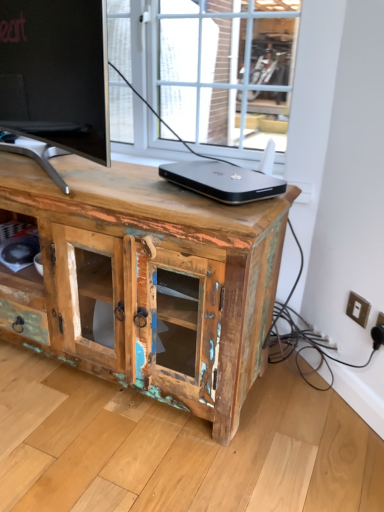
Question: Is white plastic switch at lower right, which appears as the 1th electric outlet when viewed from the back, positioned before white plastic electric outlet at lower right, positioned as the 2th electric outlet in left-to-right order?

Choices:
 (A) no
 (B) yes

Answer: (A)

Question: From a real-world perspective, is white plastic switch at lower right, which appears as the 1th electric outlet when viewed from the back, located beneath white plastic electric outlet at lower right, which ranks as the 1th electric outlet in front-to-back order?

Choices:
 (A) yes
 (B) no

Answer: (B)

Question: From the image's perspective, would you say white plastic switch at lower right, placed as the 2th electric outlet when sorted from front to back, is shown under white plastic electric outlet at lower right, positioned as the first electric outlet in right-to-left order?

Choices:
 (A) no
 (B) yes

Answer: (A)

Question: Is white plastic switch at lower right, positioned as the first electric outlet in left-to-right order, wider than white plastic electric outlet at lower right, positioned as the 2th electric outlet in left-to-right order?

Choices:
 (A) no
 (B) yes

Answer: (A)

Question: Is white plastic switch at lower right, placed as the 2th electric outlet when sorted from front to back, thinner than white plastic electric outlet at lower right, positioned as the 2th electric outlet in left-to-right order?

Choices:
 (A) yes
 (B) no

Answer: (A)

Question: Is white plastic switch at lower right, placed as the 2th electric outlet when sorted from front to back, at the right side of white plastic electric outlet at lower right, which ranks as the 1th electric outlet in front-to-back order?

Choices:
 (A) no
 (B) yes

Answer: (A)

Question: Is weathered wood cabinet at center wider than white plastic switch at lower right, positioned as the first electric outlet in left-to-right order?

Choices:
 (A) no
 (B) yes

Answer: (B)

Question: Can you confirm if weathered wood cabinet at center is taller than white plastic switch at lower right, positioned as the first electric outlet in left-to-right order?

Choices:
 (A) yes
 (B) no

Answer: (A)

Question: Is weathered wood cabinet at center positioned in front of white plastic switch at lower right, positioned as the first electric outlet in left-to-right order?

Choices:
 (A) yes
 (B) no

Answer: (A)

Question: From the image's perspective, is weathered wood cabinet at center above white plastic switch at lower right, placed as the 2th electric outlet when sorted from front to back?

Choices:
 (A) yes
 (B) no

Answer: (A)

Question: From a real-world perspective, is weathered wood cabinet at center below white plastic switch at lower right, positioned as the first electric outlet in left-to-right order?

Choices:
 (A) no
 (B) yes

Answer: (A)

Question: From a real-world perspective, is weathered wood cabinet at center physically above white plastic switch at lower right, which appears as the 1th electric outlet when viewed from the back?

Choices:
 (A) yes
 (B) no

Answer: (A)

Question: Is weathered wood cabinet at center not within white plastic electric outlet at lower right, positioned as the 2th electric outlet in left-to-right order?

Choices:
 (A) no
 (B) yes

Answer: (B)